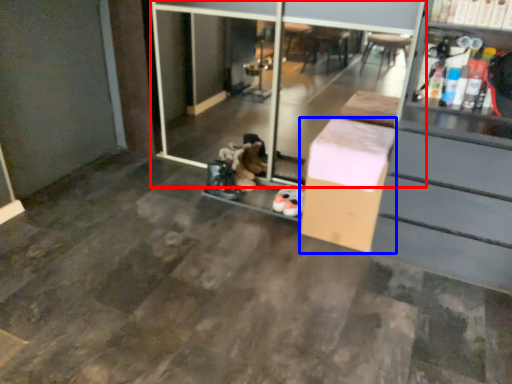
Question: Which point is closer to the camera, screen door (highlighted by a red box) or box (highlighted by a blue box)?

Choices:
 (A) screen door
 (B) box

Answer: (A)